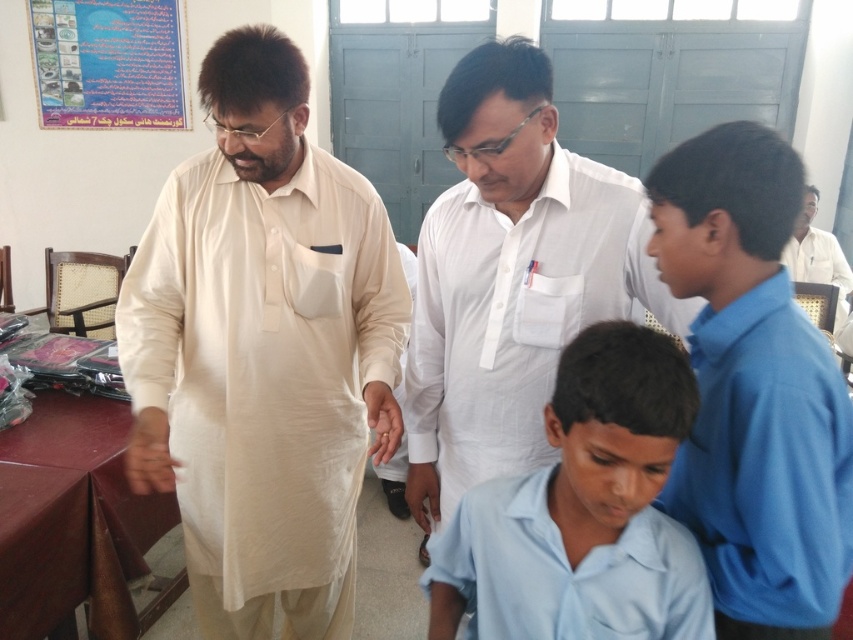
In the image, there are two adults and two children in an indoor setting. The adult on the left is wearing a cream colored kurta with a pocket on the left side, and the adult on the right is wearing a white shirt with a pen clipped to his pocket. There is a point at coordinates (263, 349). What object is located at this point?

The beige cotton kurta at center is located at point (263, 349).